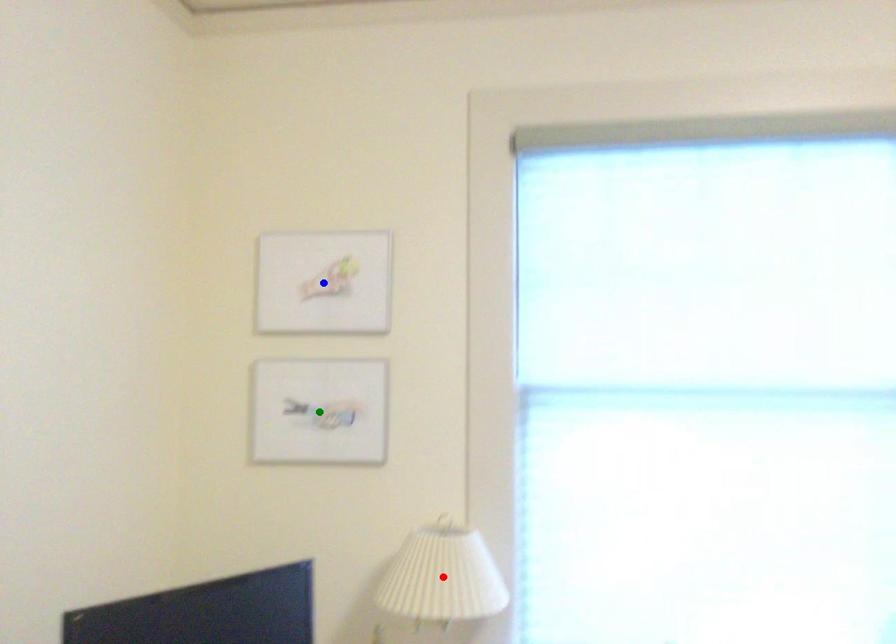
Order these from nearest to farthest:
red point, green point, blue point

red point → green point → blue point